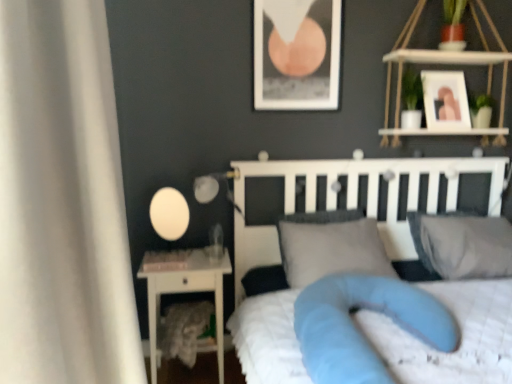
Identify the location of vacant space underneath white matte table lamp at left, the 2th table lamp from the right (from a real-world perspective). (172, 251).